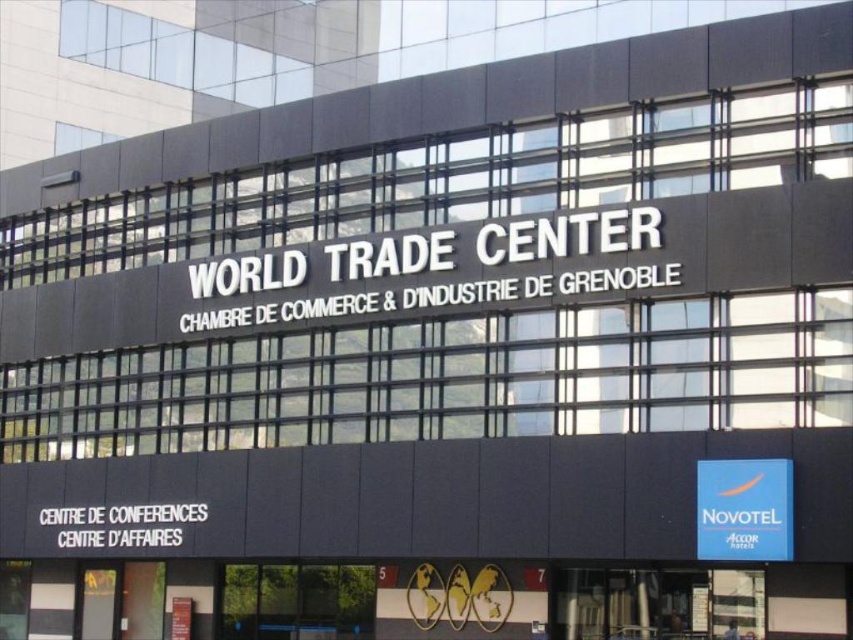
Question: Which of the following is the farthest from the observer?

Choices:
 (A) (717, 474)
 (B) (399, 236)

Answer: (B)

Question: Is white metallic sign at center wider than blue fabric sign at center?

Choices:
 (A) no
 (B) yes

Answer: (B)

Question: Can you confirm if white metallic sign at center is positioned to the right of blue fabric sign at center?

Choices:
 (A) yes
 (B) no

Answer: (B)

Question: Is white metallic sign at center closer to the viewer compared to blue fabric sign at center?

Choices:
 (A) yes
 (B) no

Answer: (B)